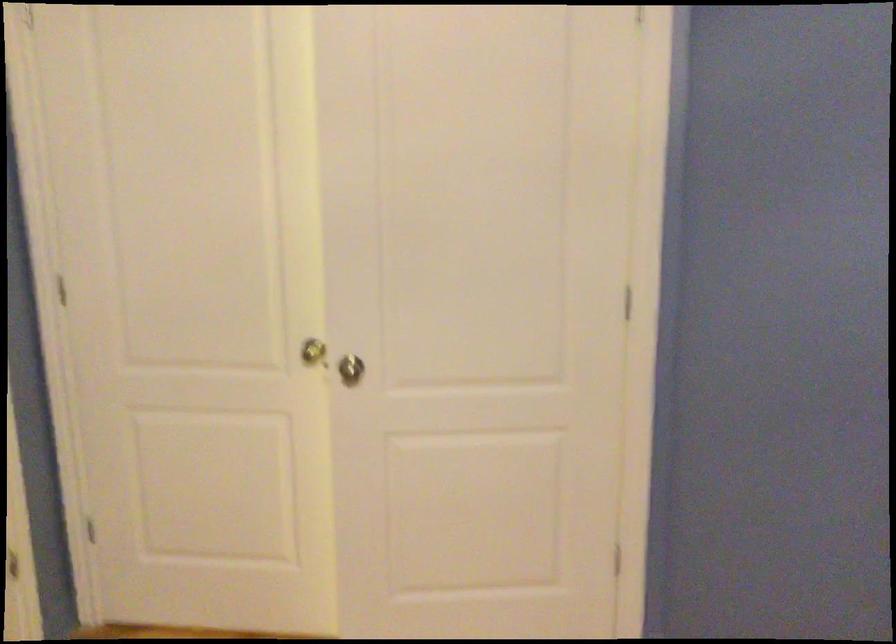
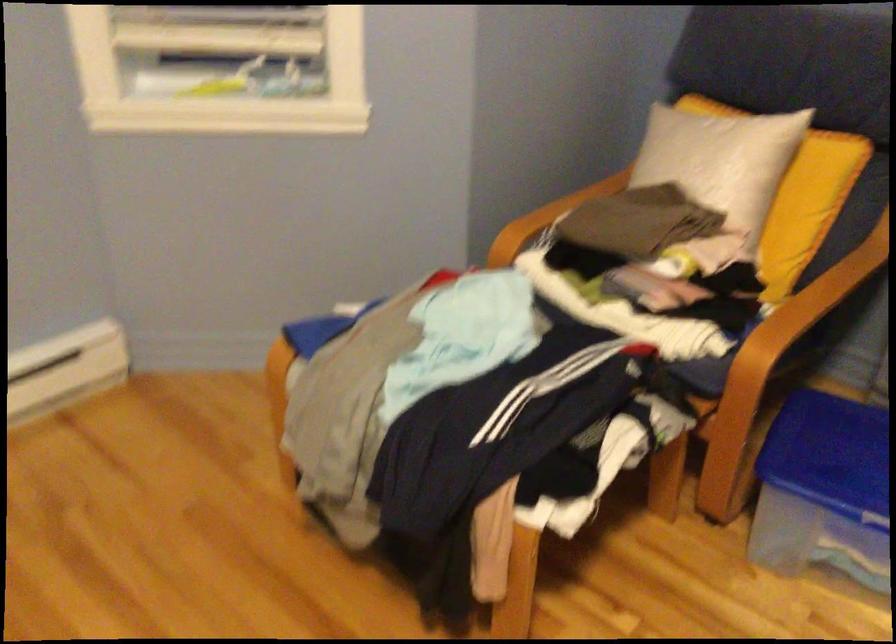
Based on the continuous images, in which direction is the camera rotating?

The camera's rotation is toward left-down.